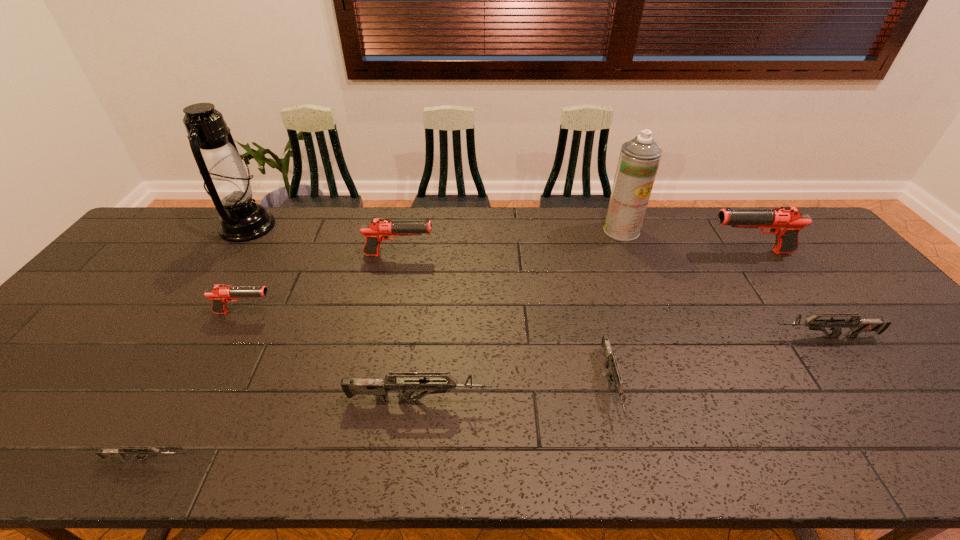
Find the location of a particular element. the third smallest grey gun is located at coordinates click(857, 325).

Locate an element on the screen. Image resolution: width=960 pixels, height=540 pixels. the seventh tallest object is located at coordinates (857, 325).

Locate an element on the screen. The width and height of the screenshot is (960, 540). the second smallest grey gun is located at coordinates (610, 359).

Where is `the sixth object from left to right`? Image resolution: width=960 pixels, height=540 pixels. the sixth object from left to right is located at coordinates (610, 359).

I want to click on the smallest grey gun, so click(122, 452).

Locate an element on the screen. This screenshot has height=540, width=960. the leftmost grey gun is located at coordinates (122, 452).

Locate an element on the screen. Image resolution: width=960 pixels, height=540 pixels. free space located on the front of the oil lamp is located at coordinates (218, 271).

You are a GUI agent. You are given a task and a screenshot of the screen. Output one action in this format:
    pyautogui.click(x=<x>, y=<y>)
    Task: Click on the free space located on the front of the seventh object from left to right
    
    Given the screenshot: What is the action you would take?
    pyautogui.click(x=663, y=337)

Locate an element on the screen. vacant region located 0.370m at the aiming end of the third tallest object is located at coordinates (588, 252).

The image size is (960, 540). I want to click on vacant space located at the aiming end of the third tallest object, so click(x=582, y=252).